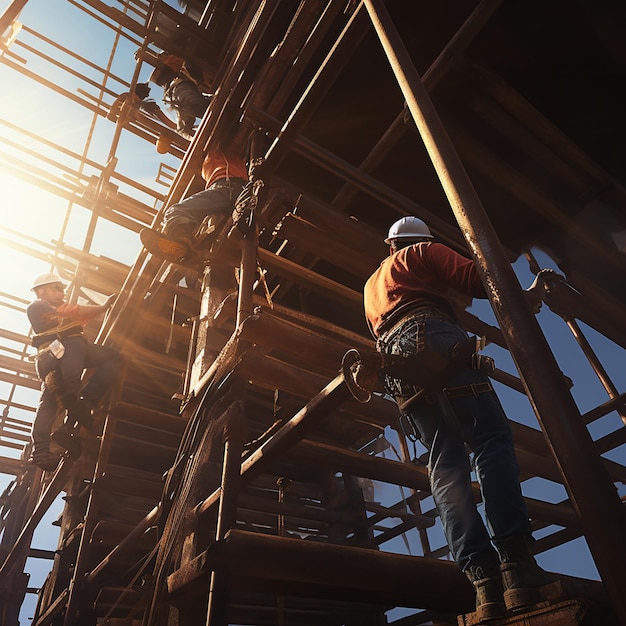
Where is `wooden beams`? wooden beams is located at coordinates pyautogui.click(x=453, y=182), pyautogui.click(x=249, y=287), pyautogui.click(x=93, y=218), pyautogui.click(x=120, y=298), pyautogui.click(x=207, y=326), pyautogui.click(x=307, y=419), pyautogui.click(x=282, y=555), pyautogui.click(x=94, y=490).